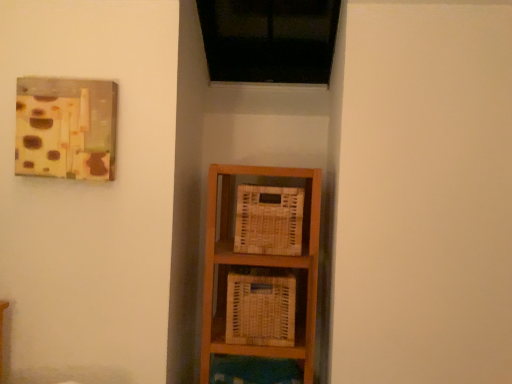
Measure the distance between woven wood basket at center, marked as the 1th basket in a top-to-bottom arrangement, and camera.

They are 4.54 feet apart.

Image resolution: width=512 pixels, height=384 pixels. In order to click on woven wood basket at center, marked as the 1th basket in a top-to-bottom arrangement in this screenshot , I will do coord(269,220).

Describe the element at coordinates (269, 220) in the screenshot. This screenshot has width=512, height=384. I see `woven wood basket at center, marked as the 1th basket in a top-to-bottom arrangement` at that location.

Find the location of a particular element. The height and width of the screenshot is (384, 512). white woven basket at center, the second basket viewed from the top is located at coordinates (260, 307).

Measure the distance between white woven basket at center, the second basket viewed from the top, and camera.

A distance of 1.39 meters exists between white woven basket at center, the second basket viewed from the top, and camera.

What do you see at coordinates (260, 307) in the screenshot?
I see `white woven basket at center, the 1th basket when ordered from bottom to top` at bounding box center [260, 307].

Find the location of a particular element. The width and height of the screenshot is (512, 384). woven wood basket at center, marked as the 1th basket in a top-to-bottom arrangement is located at coordinates [x=269, y=220].

Can you confirm if white woven basket at center, the 1th basket when ordered from bottom to top, is positioned to the right of woven wood basket at center, placed as the second basket when sorted from bottom to top?

No, white woven basket at center, the 1th basket when ordered from bottom to top, is not to the right of woven wood basket at center, placed as the second basket when sorted from bottom to top.

Is white woven basket at center, the second basket viewed from the top, positioned before woven wood basket at center, marked as the 1th basket in a top-to-bottom arrangement?

Yes, white woven basket at center, the second basket viewed from the top, is closer to the camera.

Which is farther from the camera, (x=228, y=335) or (x=257, y=240)?

Positioned behind is point (x=257, y=240).

From the image's perspective, between white woven basket at center, the second basket viewed from the top, and woven wood basket at center, marked as the 1th basket in a top-to-bottom arrangement, which one is located above?

woven wood basket at center, marked as the 1th basket in a top-to-bottom arrangement, from the image's perspective.

From a real-world perspective, which is physically above, white woven basket at center, the second basket viewed from the top, or woven wood basket at center, placed as the second basket when sorted from bottom to top?

From a 3D spatial view, woven wood basket at center, placed as the second basket when sorted from bottom to top, is above.

Looking at their sizes, would you say white woven basket at center, the second basket viewed from the top, is wider or thinner than woven wood basket at center, placed as the second basket when sorted from bottom to top?

In the image, white woven basket at center, the second basket viewed from the top, appears to be wider than woven wood basket at center, placed as the second basket when sorted from bottom to top.

Considering the sizes of objects white woven basket at center, the 1th basket when ordered from bottom to top, and woven wood basket at center, marked as the 1th basket in a top-to-bottom arrangement, in the image provided, who is taller, white woven basket at center, the 1th basket when ordered from bottom to top, or woven wood basket at center, marked as the 1th basket in a top-to-bottom arrangement,?

Standing taller between the two is white woven basket at center, the 1th basket when ordered from bottom to top.

Who is smaller, white woven basket at center, the 1th basket when ordered from bottom to top, or woven wood basket at center, placed as the second basket when sorted from bottom to top?

woven wood basket at center, placed as the second basket when sorted from bottom to top, is smaller.

Is woven wood basket at center, marked as the 1th basket in a top-to-bottom arrangement, completely or partially inside white woven basket at center, the second basket viewed from the top?

Actually, woven wood basket at center, marked as the 1th basket in a top-to-bottom arrangement, is outside white woven basket at center, the second basket viewed from the top.

Would you say white woven basket at center, the second basket viewed from the top, is a long distance from woven wood basket at center, placed as the second basket when sorted from bottom to top?

white woven basket at center, the second basket viewed from the top, is actually quite close to woven wood basket at center, placed as the second basket when sorted from bottom to top.

Is white woven basket at center, the 1th basket when ordered from bottom to top, facing towards woven wood basket at center, placed as the second basket when sorted from bottom to top?

No, white woven basket at center, the 1th basket when ordered from bottom to top, does not turn towards woven wood basket at center, placed as the second basket when sorted from bottom to top.

Identify the location of basket above the white woven basket at center, the 1th basket when ordered from bottom to top (from a real-world perspective). (269, 220).

Is woven wood basket at center, placed as the second basket when sorted from bottom to top, at the left side of white woven basket at center, the 1th basket when ordered from bottom to top?

In fact, woven wood basket at center, placed as the second basket when sorted from bottom to top, is to the right of white woven basket at center, the 1th basket when ordered from bottom to top.

Is woven wood basket at center, marked as the 1th basket in a top-to-bottom arrangement, behind white woven basket at center, the 1th basket when ordered from bottom to top?

Yes, it is.

Between point (301, 194) and point (272, 310), which one is positioned in front?

The point (301, 194) is closer.

From the image's perspective, is woven wood basket at center, marked as the 1th basket in a top-to-bottom arrangement, above or below white woven basket at center, the second basket viewed from the top?

From the image's perspective, woven wood basket at center, marked as the 1th basket in a top-to-bottom arrangement, appears above white woven basket at center, the second basket viewed from the top.

From a real-world perspective, is woven wood basket at center, marked as the 1th basket in a top-to-bottom arrangement, positioned under white woven basket at center, the 1th basket when ordered from bottom to top, based on gravity?

No, from a real-world perspective, woven wood basket at center, marked as the 1th basket in a top-to-bottom arrangement, is not below white woven basket at center, the 1th basket when ordered from bottom to top.

Considering the relative sizes of woven wood basket at center, marked as the 1th basket in a top-to-bottom arrangement, and white woven basket at center, the second basket viewed from the top, in the image provided, is woven wood basket at center, marked as the 1th basket in a top-to-bottom arrangement, thinner than white woven basket at center, the second basket viewed from the top,?

Yes.

Who is shorter, woven wood basket at center, marked as the 1th basket in a top-to-bottom arrangement, or white woven basket at center, the 1th basket when ordered from bottom to top?

With less height is woven wood basket at center, marked as the 1th basket in a top-to-bottom arrangement.

Can you confirm if woven wood basket at center, marked as the 1th basket in a top-to-bottom arrangement, is smaller than white woven basket at center, the 1th basket when ordered from bottom to top?

Correct, woven wood basket at center, marked as the 1th basket in a top-to-bottom arrangement, occupies less space than white woven basket at center, the 1th basket when ordered from bottom to top.

Is white woven basket at center, the 1th basket when ordered from bottom to top, located within woven wood basket at center, placed as the second basket when sorted from bottom to top?

No, woven wood basket at center, placed as the second basket when sorted from bottom to top, does not contain white woven basket at center, the 1th basket when ordered from bottom to top.

Is woven wood basket at center, marked as the 1th basket in a top-to-bottom arrangement, not close to white woven basket at center, the 1th basket when ordered from bottom to top?

woven wood basket at center, marked as the 1th basket in a top-to-bottom arrangement, is near white woven basket at center, the 1th basket when ordered from bottom to top, not far away.

Is woven wood basket at center, placed as the second basket when sorted from bottom to top, looking in the opposite direction of white woven basket at center, the 1th basket when ordered from bottom to top?

woven wood basket at center, placed as the second basket when sorted from bottom to top, is not turned away from white woven basket at center, the 1th basket when ordered from bottom to top.

What's the angular difference between woven wood basket at center, marked as the 1th basket in a top-to-bottom arrangement, and white woven basket at center, the second basket viewed from the top,'s facing directions?

woven wood basket at center, marked as the 1th basket in a top-to-bottom arrangement, and white woven basket at center, the second basket viewed from the top, are facing 0.966 degrees away from each other.

This screenshot has width=512, height=384. Find the location of `basket that is above the white woven basket at center, the second basket viewed from the top (from a real-world perspective)`. basket that is above the white woven basket at center, the second basket viewed from the top (from a real-world perspective) is located at coordinates (269, 220).

The width and height of the screenshot is (512, 384). I want to click on basket in front of the woven wood basket at center, placed as the second basket when sorted from bottom to top, so click(x=260, y=307).

I want to click on basket on the left side of woven wood basket at center, marked as the 1th basket in a top-to-bottom arrangement, so click(260, 307).